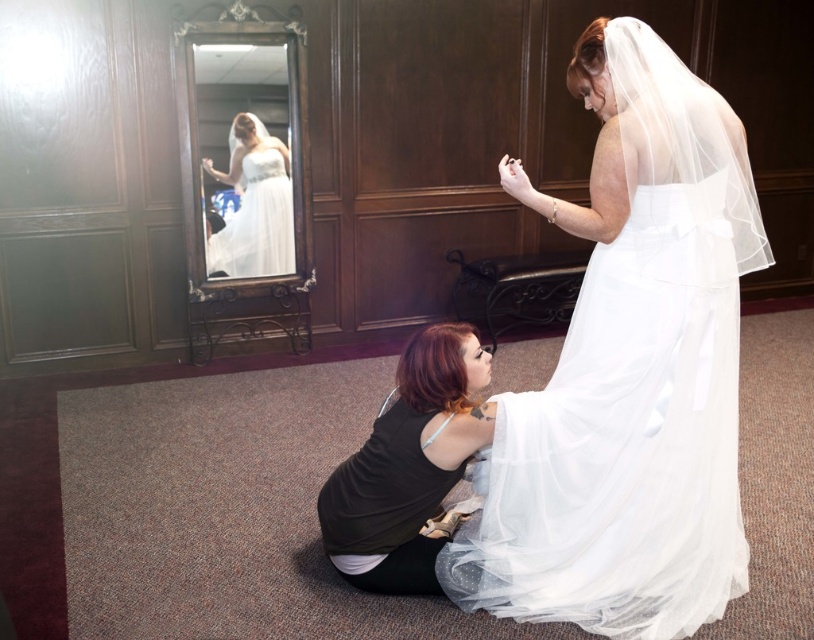
Question: Which point appears farthest from the camera in this image?

Choices:
 (A) (390, 497)
 (B) (290, 180)
 (C) (650, 570)

Answer: (B)

Question: Is white tulle dress at lower center wider than wooden-framed mirror at center?

Choices:
 (A) no
 (B) yes

Answer: (B)

Question: Which is nearer to the white satin dress at center?

Choices:
 (A) white tulle dress at lower center
 (B) wooden-framed mirror at center

Answer: (B)

Question: Considering the real-world distances, which object is farthest from the white satin dress at center?

Choices:
 (A) black matte tank top at lower center
 (B) white tulle dress at lower center
 (C) wooden-framed mirror at center

Answer: (B)

Question: Is white tulle dress at lower center to the right of white satin dress at center from the viewer's perspective?

Choices:
 (A) yes
 (B) no

Answer: (A)

Question: Observing the image, what is the correct spatial positioning of white tulle dress at lower center in reference to black matte tank top at lower center?

Choices:
 (A) above
 (B) below

Answer: (A)